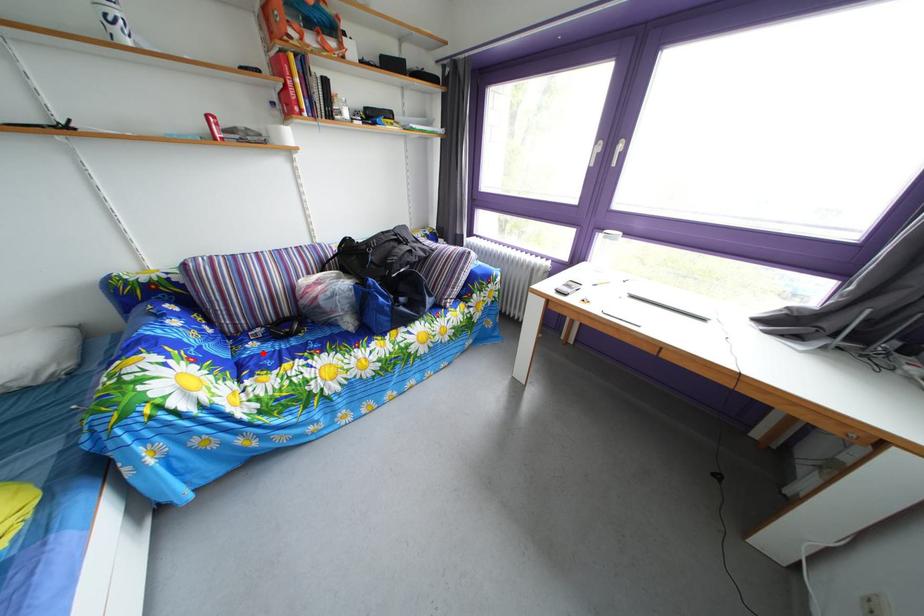
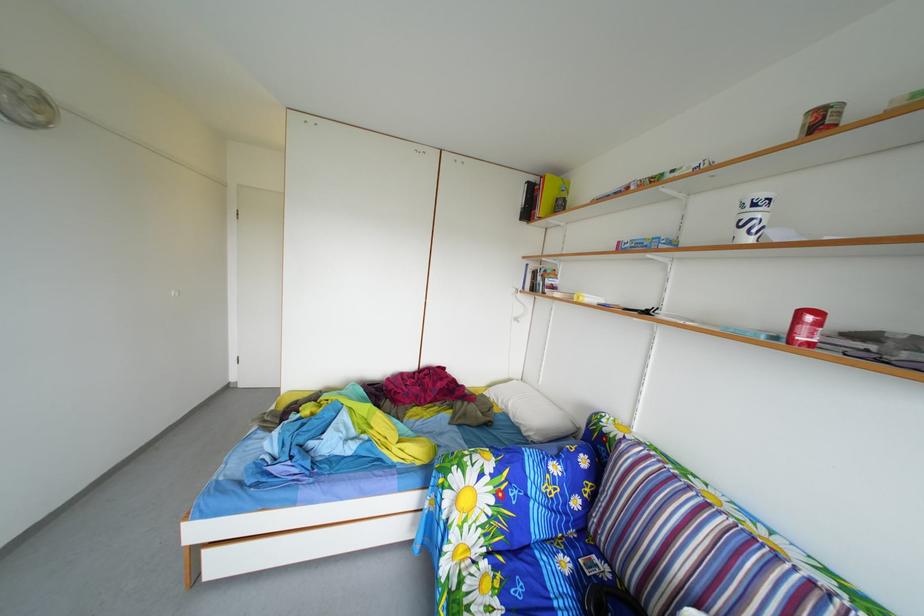
Question: I am providing you with two images of the same scene from different viewpoints. A red point is marked on the first image. Is the red point's position out of view in image 2?

Choices:
 (A) Yes
 (B) No

Answer: (B)